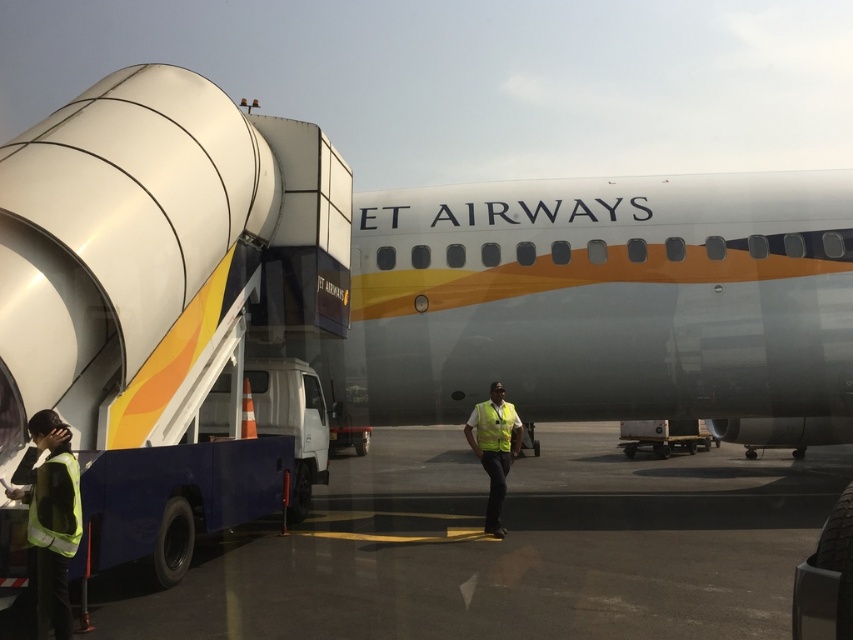
Does gray asphalt at center have a larger size compared to yellow reflective safety vest at center?

Yes.

Who is taller, gray asphalt at center or yellow reflective safety vest at center?

→ gray asphalt at center is taller.

Measure the distance between gray asphalt at center and camera.

gray asphalt at center and camera are 4.35 meters apart.

Where is `gray asphalt at center`? gray asphalt at center is located at coordinates (508, 548).

Is silver metallic airplane at center in front of yellow reflective safety vest at center?

No, silver metallic airplane at center is behind yellow reflective safety vest at center.

Looking at this image, measure the distance between silver metallic airplane at center and camera.

silver metallic airplane at center and camera are 8.30 meters apart from each other.

The height and width of the screenshot is (640, 853). I want to click on silver metallic airplane at center, so click(x=610, y=301).

Between point (62, 552) and point (491, 403), which one is positioned behind?

Positioned behind is point (491, 403).

This screenshot has width=853, height=640. Identify the location of yellow reflective safety vest at lower left. (73, 513).